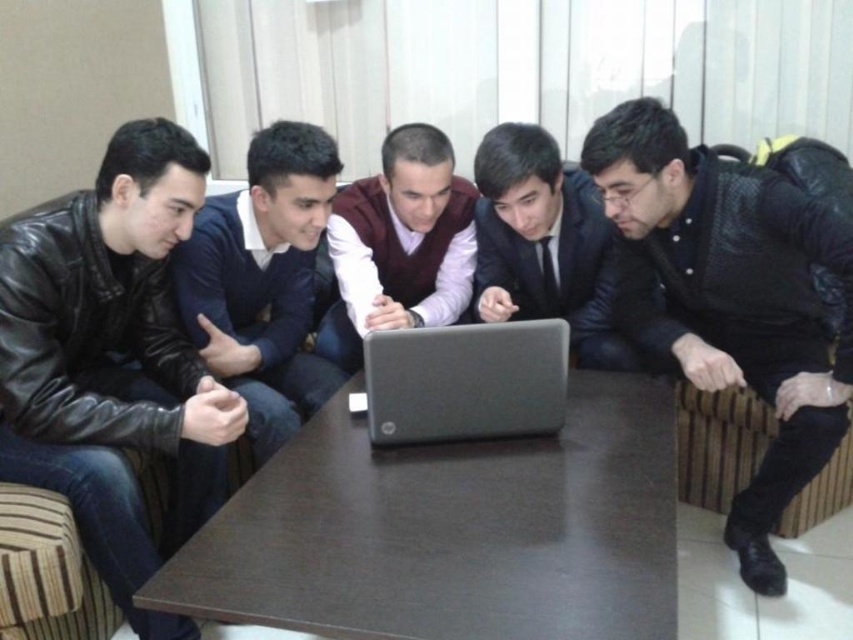
You are planning to sit between the black leather jacket at lower right and the dark blue sweater at center. Is there enough space for you to sit comfortably?

The black leather jacket at lower right might be wider than dark blue sweater at center, so there might not be enough space between them for you to sit comfortably.

You are organizing a photo shoot and need to ensure that all clothing items in the scene are visible. Given that the black leather jacket at lower right and the maroon sweater at center are both in the frame, which clothing item requires more space to be fully captured in the photo?

The black leather jacket at lower right requires more space to be fully captured in the photo because its width is larger than that of the maroon sweater at center.